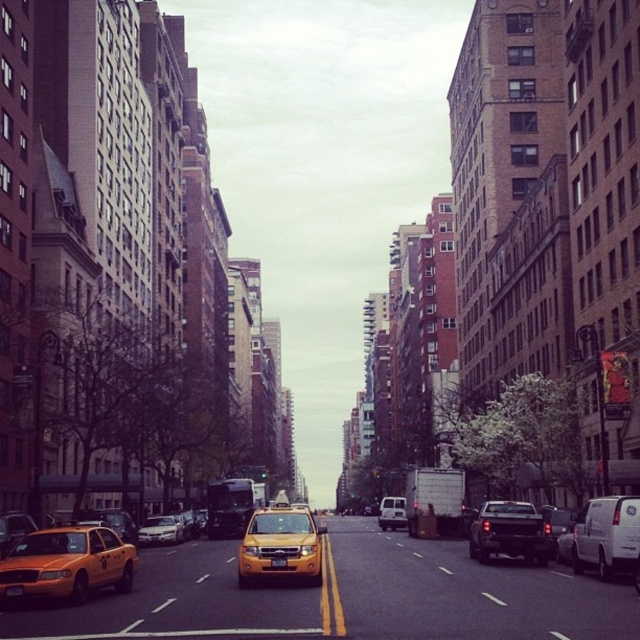
You are a pedestrian standing on the sidewalk and want to cross the street to reach the store on the opposite side. There is a black matte truck at center and a white matte van at center blocking your view. Which vehicle should you move around to see the store clearly?

You should move around the white matte van at center because the black matte truck at center is in front of it, meaning the van is further back and moving around it would provide a clearer view of the store.

You are standing at the edge of the street and see the black matte truck at center and the white matte van at center. If you want to cross the street to reach both vehicles, which one should you head towards first to minimize the distance walked?

The black matte truck at center is 27.92 meters away from the white matte van at center. To minimize the distance walked, you should head towards the closer vehicle first. However, without knowing which is closer to your current position, it is impossible to determine which one to choose.